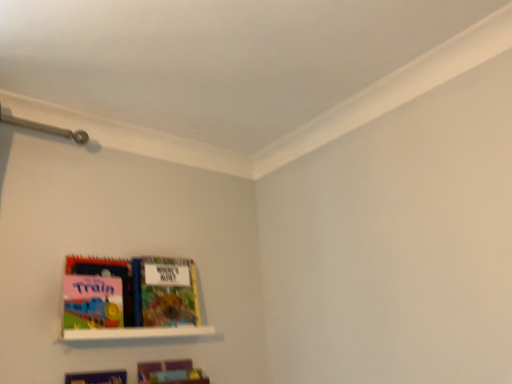
Question: Is white glossy shelf at lower left spatially inside matte plastic book at lower left, placed as the 2th book when sorted from top to bottom, or outside of it?

Choices:
 (A) outside
 (B) inside

Answer: (A)

Question: Considering the positions of point (148, 329) and point (202, 375), is point (148, 329) closer or farther from the camera than point (202, 375)?

Choices:
 (A) closer
 (B) farther

Answer: (A)

Question: Considering the real-world distances, which object is farthest from the matte plastic book at lower left, placed as the 2th book when sorted from top to bottom?

Choices:
 (A) white glossy shelf at lower left
 (B) multicolored paper book at center, which appears as the first book when viewed from the top

Answer: (B)

Question: Estimate the real-world distances between objects in this image. Which object is closer to the white glossy shelf at lower left?

Choices:
 (A) matte plastic book at lower left, placed as the 2th book when sorted from top to bottom
 (B) multicolored paper book at center, marked as the second book in a bottom-to-top arrangement

Answer: (B)